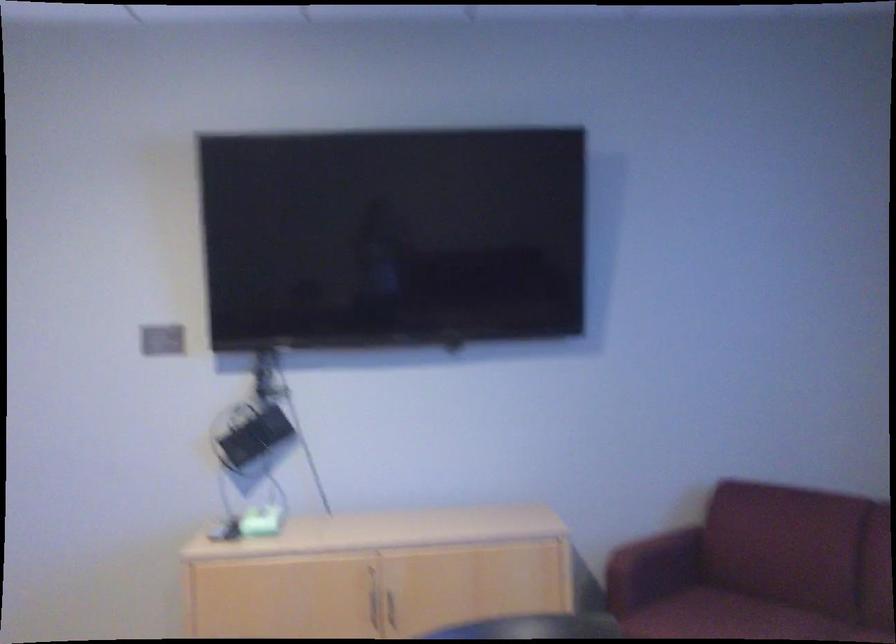
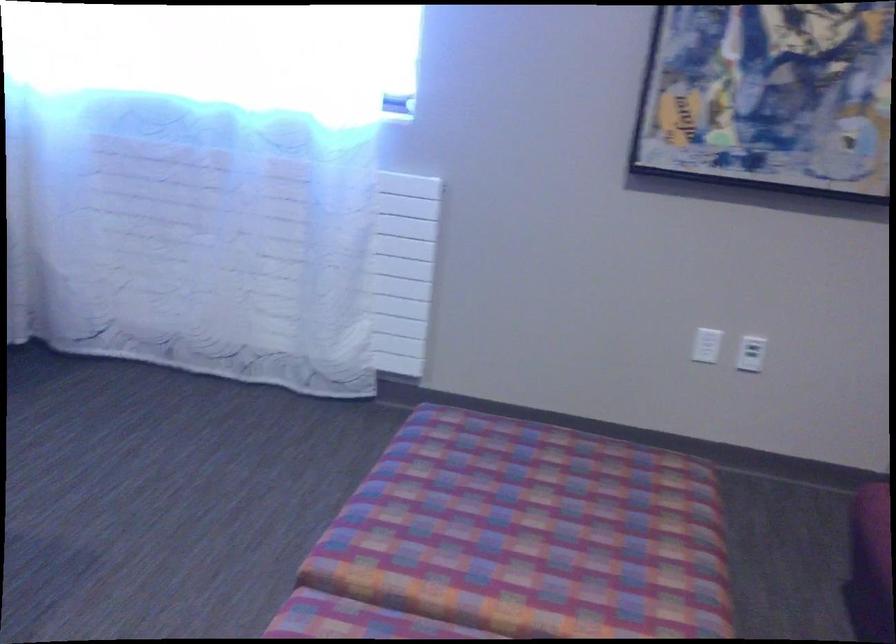
Based on the continuous images, in which direction is the camera rotating?

The rotation direction of the camera is right-down.